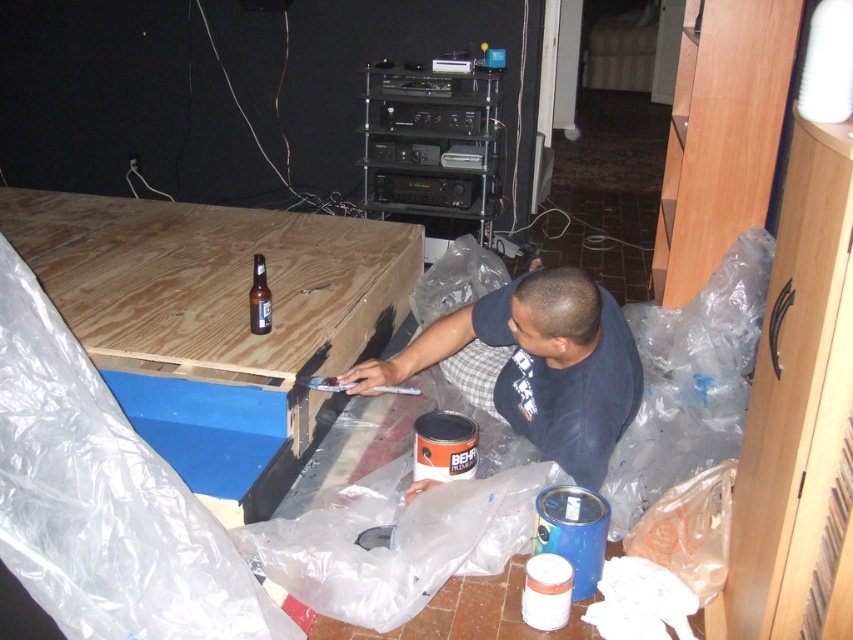
Question: Can you confirm if dark blue shirt at center is positioned to the left of brown glass beer bottle at center?

Choices:
 (A) no
 (B) yes

Answer: (A)

Question: Can you confirm if dark blue shirt at center is smaller than brown glass beer bottle at center?

Choices:
 (A) yes
 (B) no

Answer: (B)

Question: Which of the following is the closest to the observer?

Choices:
 (A) (601, 438)
 (B) (260, 296)

Answer: (A)

Question: Is dark blue shirt at center positioned before brown glass beer bottle at center?

Choices:
 (A) yes
 (B) no

Answer: (A)